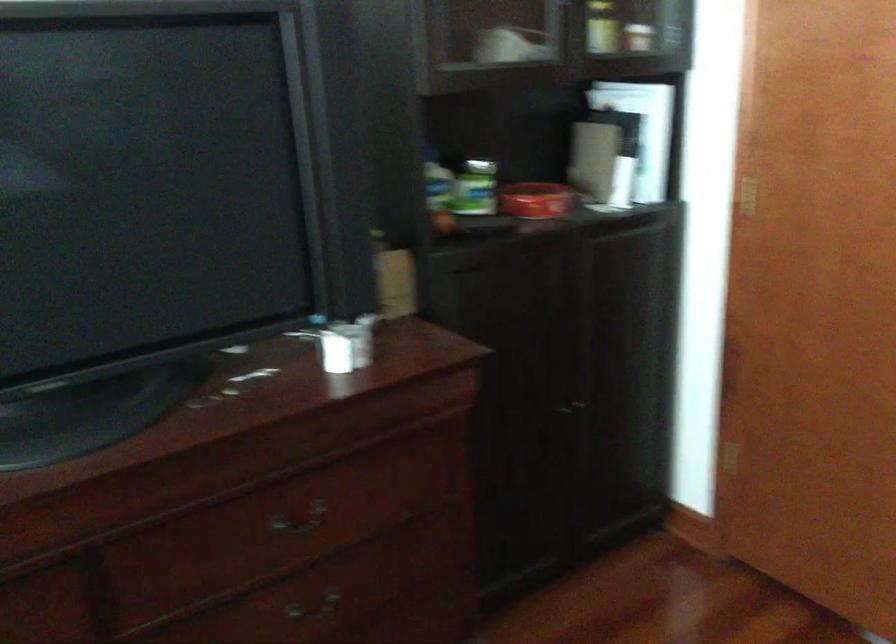
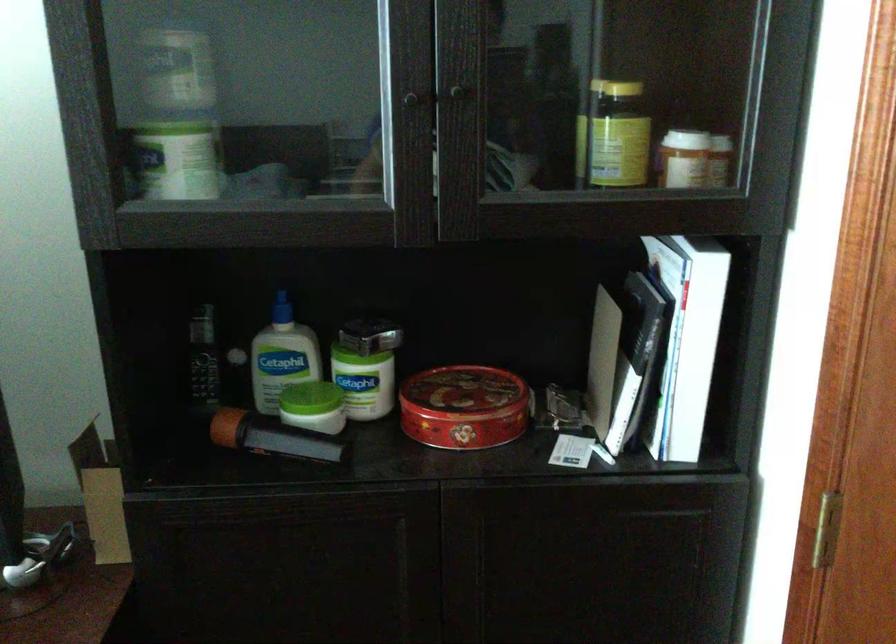
The point at (x=535, y=191) is marked in the first image. Where is the corresponding point in the second image?

(462, 393)